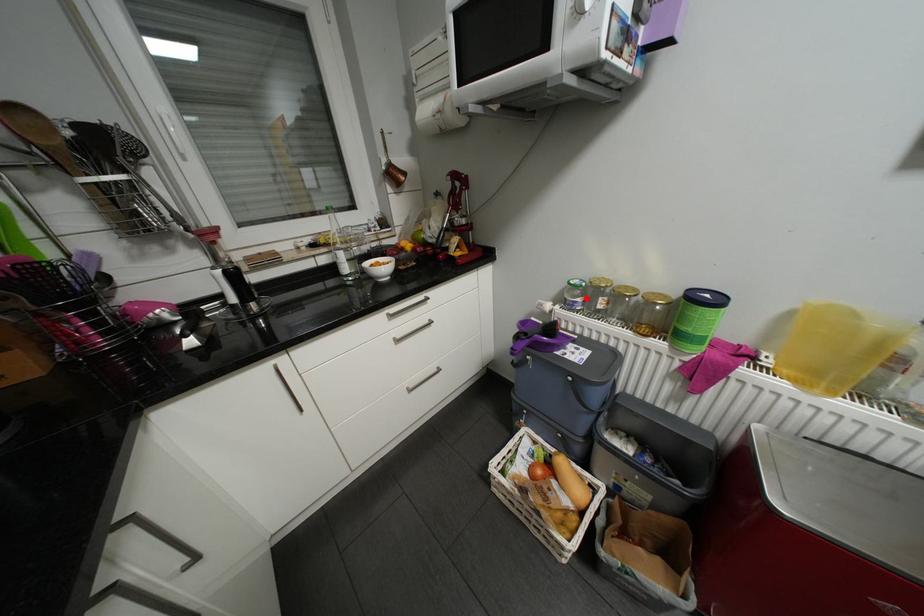
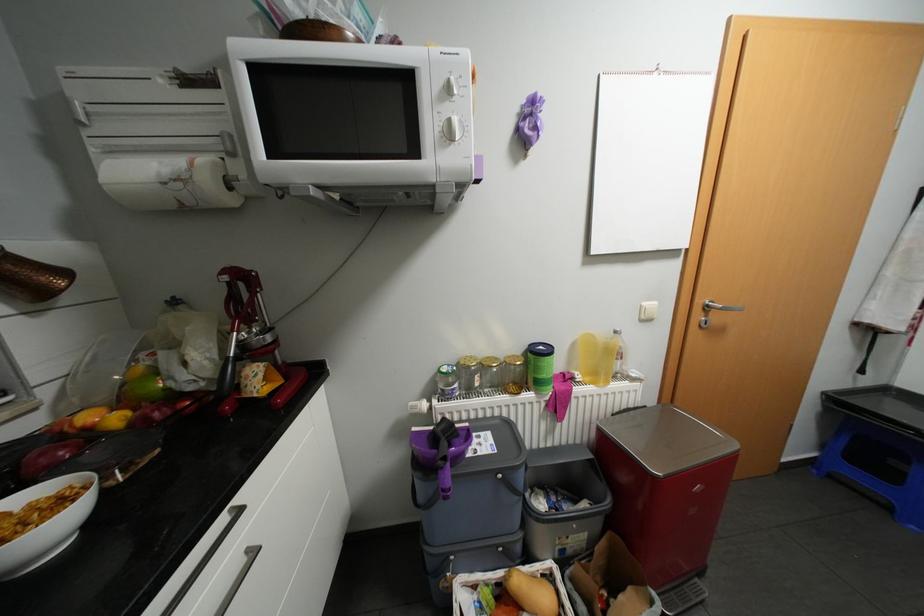
Question: I am providing you with two images of the same scene from different viewpoints. In image1, a red point is highlighted. Considering the same 3D point in image2, which of the following is correct?

Choices:
 (A) It is closer
 (B) It is farther

Answer: (B)